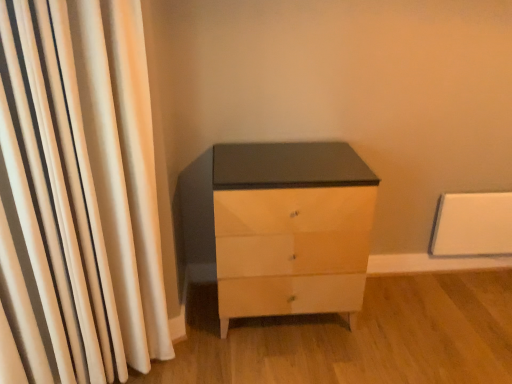
Identify the location of vacant location below white fabric curtain at left (from a real-world perspective). Image resolution: width=512 pixels, height=384 pixels. (151, 370).